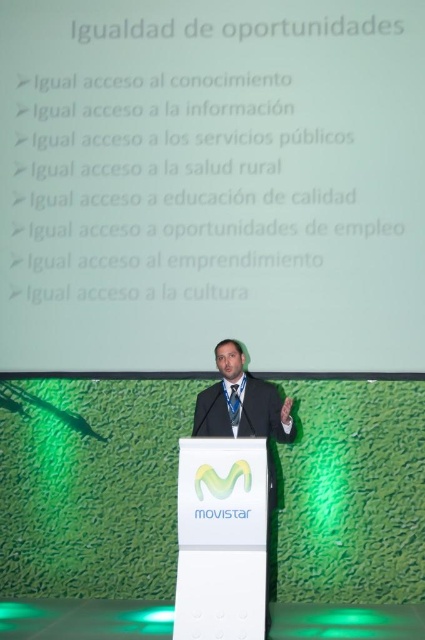
Can you confirm if white plastic podium at center is taller than black fabric business suit at center?

Correct, white plastic podium at center is much taller as black fabric business suit at center.

How distant is white plastic podium at center from black fabric business suit at center?

white plastic podium at center and black fabric business suit at center are 52.65 centimeters apart.

This screenshot has width=425, height=640. Describe the element at coordinates (221, 540) in the screenshot. I see `white plastic podium at center` at that location.

Identify the location of white plastic podium at center. The image size is (425, 640). (221, 540).

Is white plastic podium at center to the left of blue satin tie at center from the viewer's perspective?

Correct, you'll find white plastic podium at center to the left of blue satin tie at center.

Who is more distant from viewer, (189, 628) or (235, 396)?

Point (235, 396)

Who is more distant from viewer, (231, 618) or (235, 410)?

Positioned behind is point (235, 410).

The height and width of the screenshot is (640, 425). I want to click on white plastic podium at center, so click(x=221, y=540).

Can you confirm if white matte projector screen at upper center is positioned to the right of matte black suit at center?

No, white matte projector screen at upper center is not to the right of matte black suit at center.

Can you confirm if white matte projector screen at upper center is positioned to the left of matte black suit at center?

Correct, you'll find white matte projector screen at upper center to the left of matte black suit at center.

Is point (155, 243) positioned in front of point (277, 413)?

No, it is behind (277, 413).

Where is `white matte projector screen at upper center`? The image size is (425, 640). white matte projector screen at upper center is located at coordinates (212, 182).